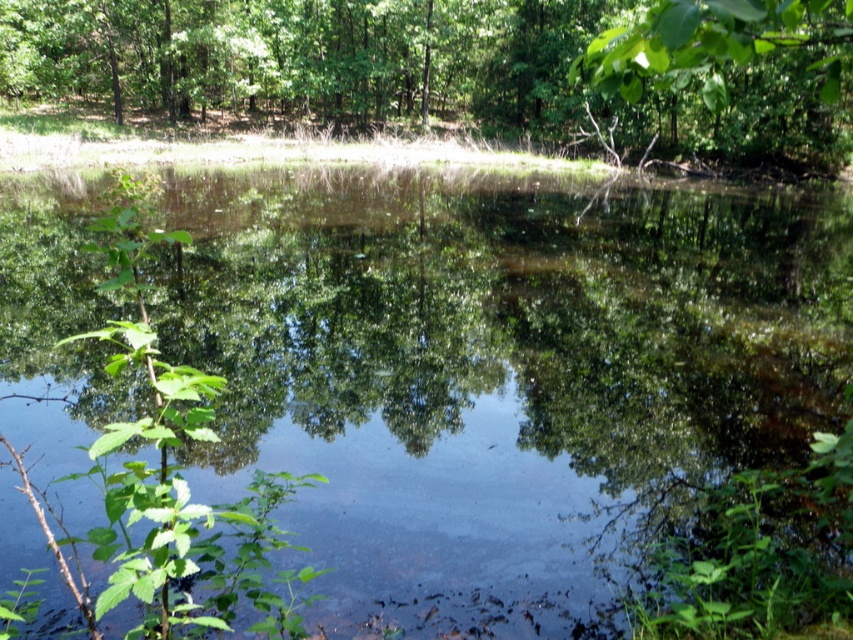
Question: Which of the following is the closest to the observer?

Choices:
 (A) (x=657, y=84)
 (B) (x=735, y=70)

Answer: (A)

Question: Considering the relative positions of transparent water at center and green leafy tree at upper center in the image provided, where is transparent water at center located with respect to green leafy tree at upper center?

Choices:
 (A) right
 (B) left

Answer: (A)

Question: Is green leafy tree at upper center above green leafy tree at upper right?

Choices:
 (A) no
 (B) yes

Answer: (B)

Question: Estimate the real-world distances between objects in this image. Which object is closer to the transparent water at center?

Choices:
 (A) green leafy tree at upper right
 (B) green leafy tree at upper center

Answer: (A)

Question: Is transparent water at center thinner than green leafy tree at upper right?

Choices:
 (A) yes
 (B) no

Answer: (B)

Question: Considering the real-world distances, which object is closest to the green leafy tree at upper center?

Choices:
 (A) green leafy tree at upper right
 (B) transparent water at center

Answer: (A)